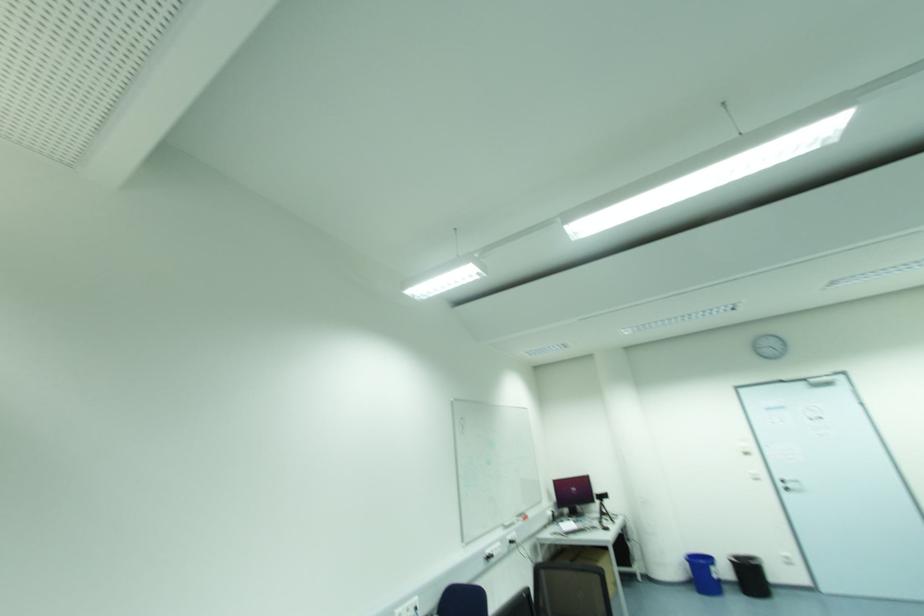
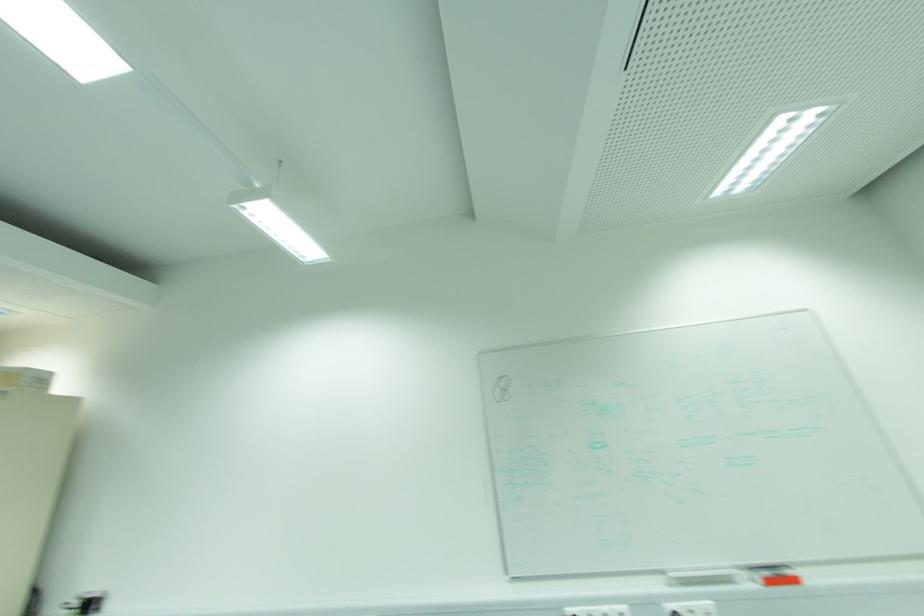
Where in the second image is the point corresponding to [528,517] from the first image?

(796, 581)